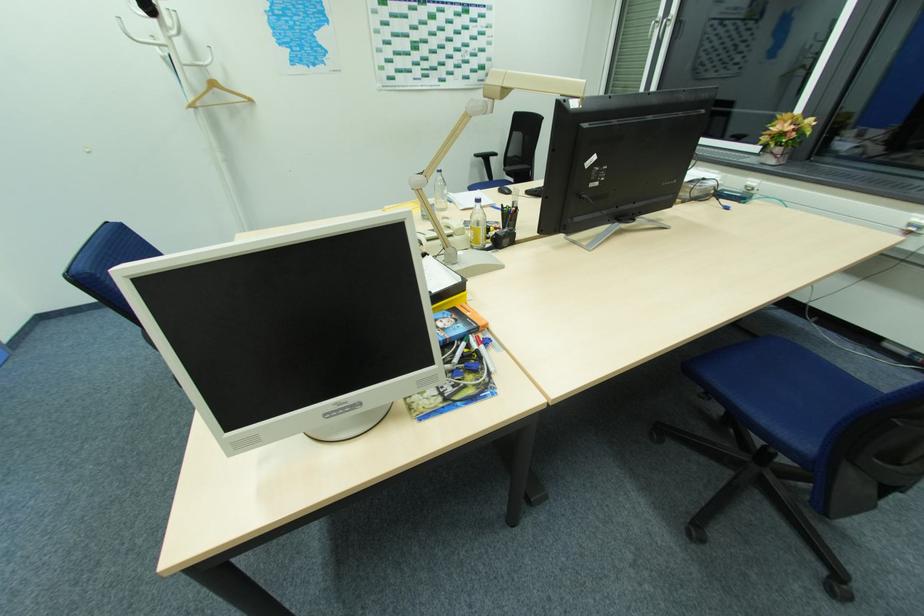
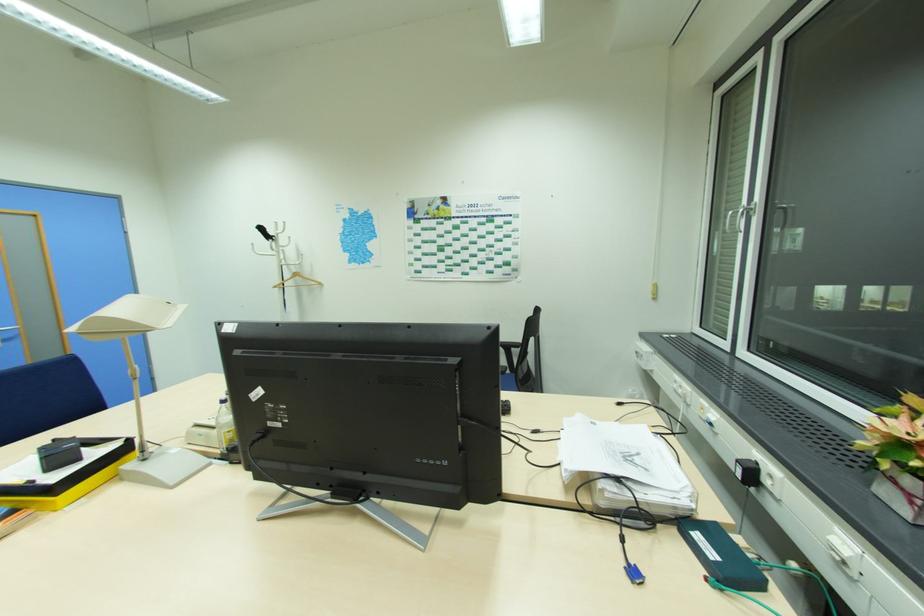
In the second image, find the point that corresponds to [756,188] in the first image.

(848, 564)